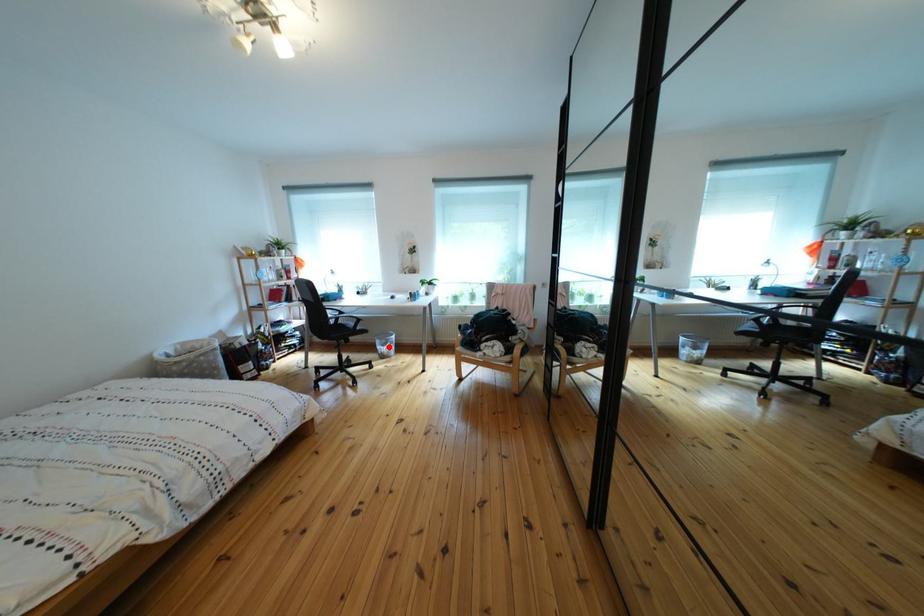
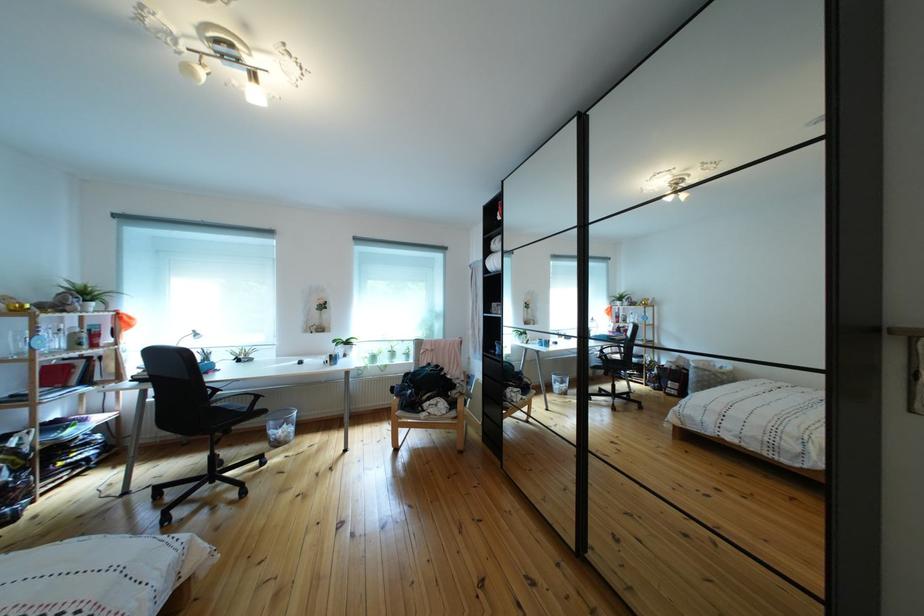
Where in the second image is the point corresponding to the highlighted location from the first image?

(283, 430)